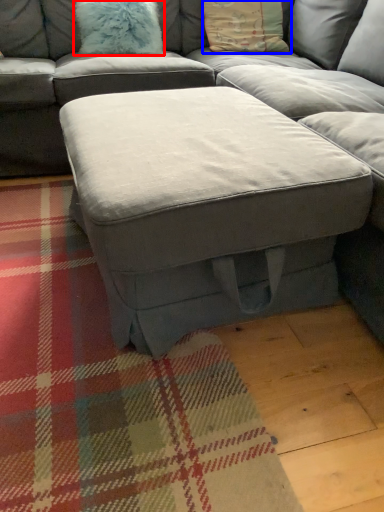
Question: Which point is closer to the camera, pillow (highlighted by a red box) or pillow (highlighted by a blue box)?

Choices:
 (A) pillow
 (B) pillow

Answer: (A)